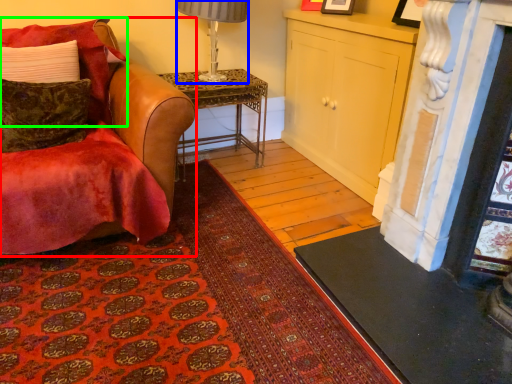
Question: Which object is positioned closest to chair (highlighted by a red box)? Select from lamp (highlighted by a blue box) and pillow (highlighted by a green box).

Choices:
 (A) lamp
 (B) pillow

Answer: (B)